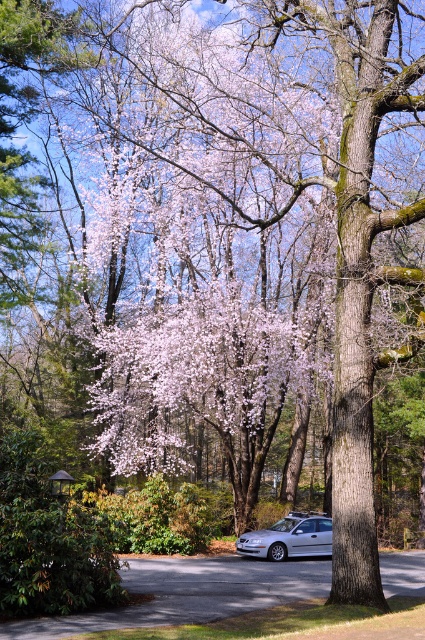
You are planning to park your car on the gray asphalt driveway at lower center but there is already a silver metallic car at lower center parked there. Based on the scene description, can your car fit on the driveway without overlapping the existing car?

The gray asphalt driveway at lower center is bigger than the silver metallic car at lower center, so there might be enough space for another car to park without overlapping, but it depends on the exact dimensions of both the driveway and your car.

In the scene shown: You are driving a silver metallic car at lower center and want to park it on the gray asphalt driveway at lower center. Can you maneuver the car into the driveway without crossing any obstacles?

The gray asphalt driveway at lower center is to the left of the silver metallic car at lower center, so you can maneuver the car into the driveway by moving left without crossing any obstacles.

You are a gardener planning to plant a new flower bed between the gray asphalt driveway at lower center and the silver metallic car at lower center. Considering their relative sizes, which object should you place the flowers closer to in order to ensure they receive adequate sunlight?

The gray asphalt driveway at lower center is taller than the silver metallic car at lower center, so placing the flowers closer to the silver metallic car at lower center would allow them to receive more sunlight as the driveway blocks less light due to its height.